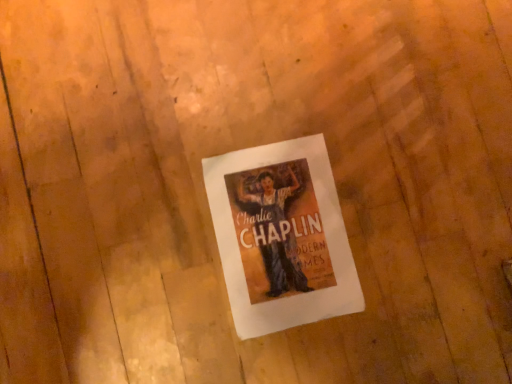
Identify the location of vacant point above white paper at center (from a real-world perspective). (287, 238).